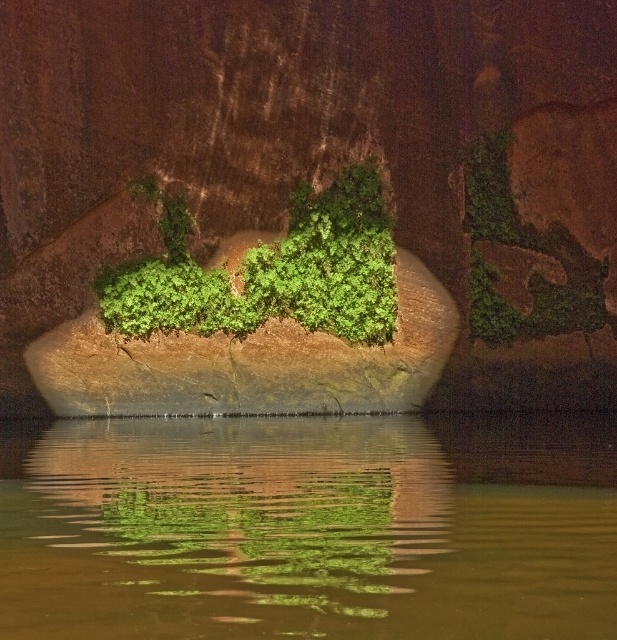
Question: From the image, what is the correct spatial relationship of green reflective water at center in relation to green leafy plant at center?

Choices:
 (A) below
 (B) above

Answer: (A)

Question: Which point is closer to the camera?

Choices:
 (A) (275, 632)
 (B) (267, 269)

Answer: (A)

Question: Is green reflective water at center behind green leafy plant at center?

Choices:
 (A) yes
 (B) no

Answer: (B)

Question: Is green reflective water at center above green leafy plant at center?

Choices:
 (A) yes
 (B) no

Answer: (B)